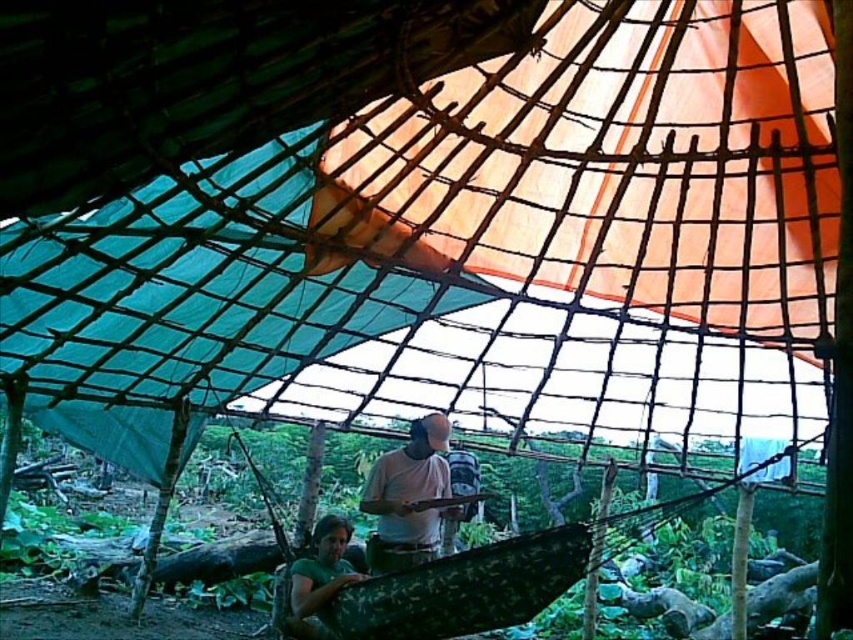
Can you confirm if white cotton shirt at center is smaller than green matte shirt at lower center?

Incorrect, white cotton shirt at center is not smaller in size than green matte shirt at lower center.

The width and height of the screenshot is (853, 640). I want to click on white cotton shirt at center, so click(408, 497).